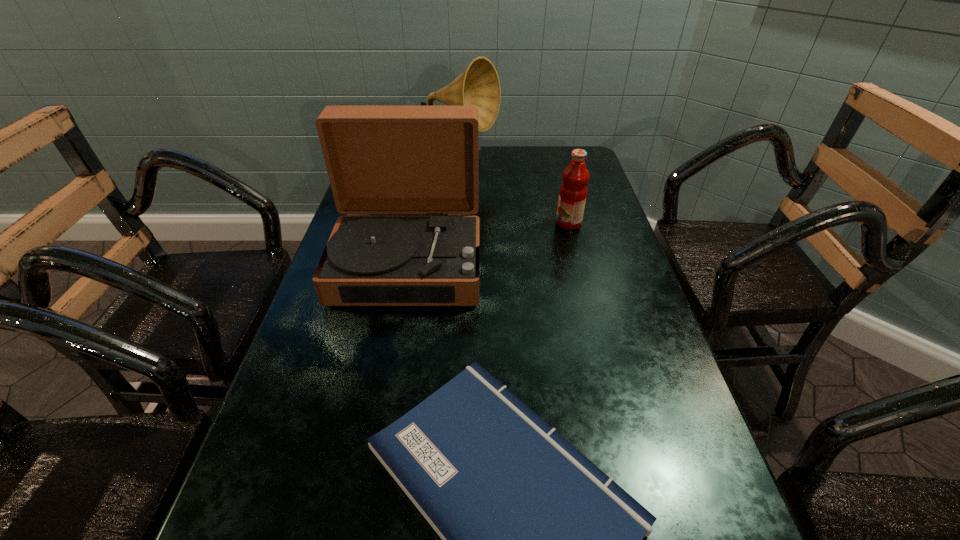
Where is `vacant space that satisfies the following two spatial constraints: 1. on the front label of the fruit juice; 2. on the face of the nearer phonograph record`? vacant space that satisfies the following two spatial constraints: 1. on the front label of the fruit juice; 2. on the face of the nearer phonograph record is located at coordinates (579, 264).

Identify the location of vacant area in the image that satisfies the following two spatial constraints: 1. on the horn of the farther phonograph record; 2. on the face of the nearer phonograph record. (453, 264).